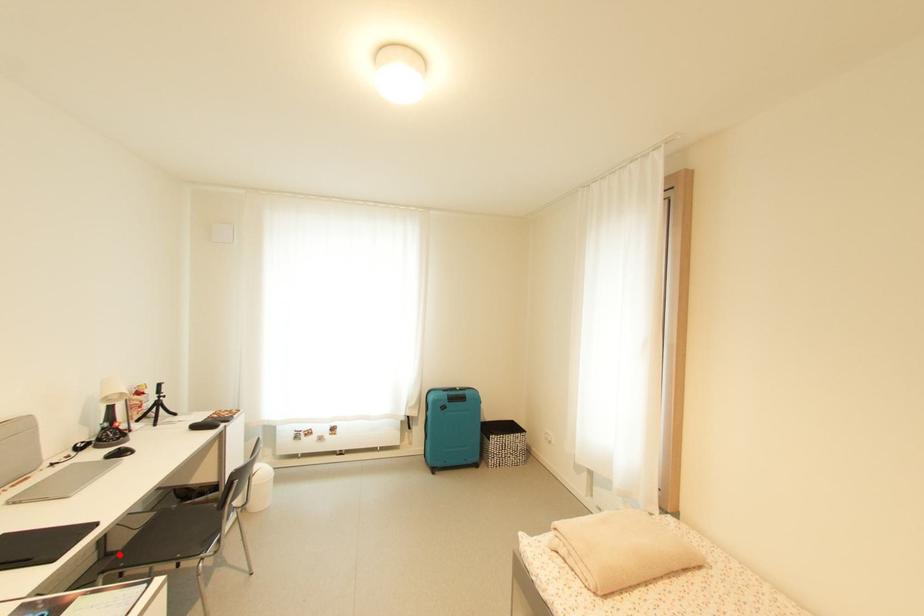
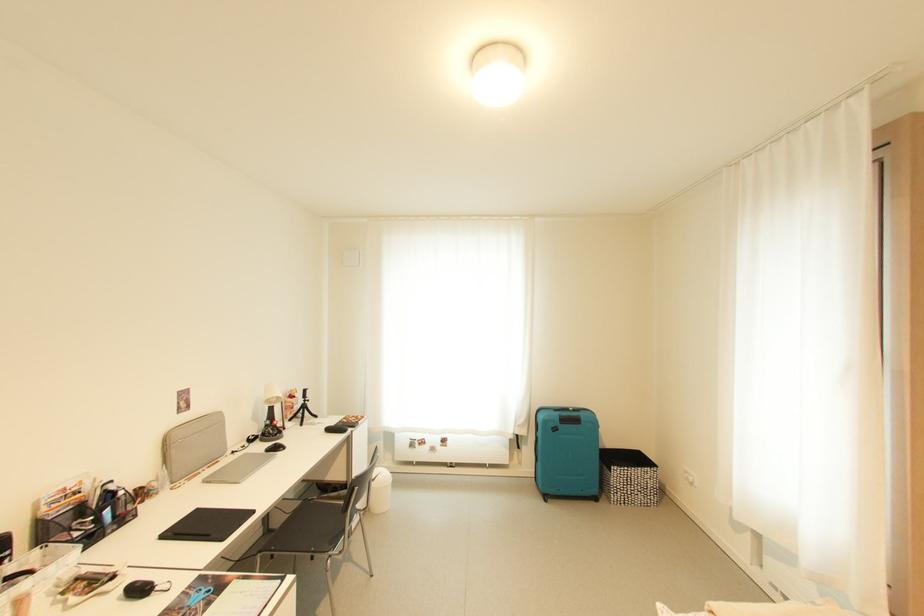
Locate, in the second image, the point that corresponds to the highlighted location in the first image.

(276, 533)